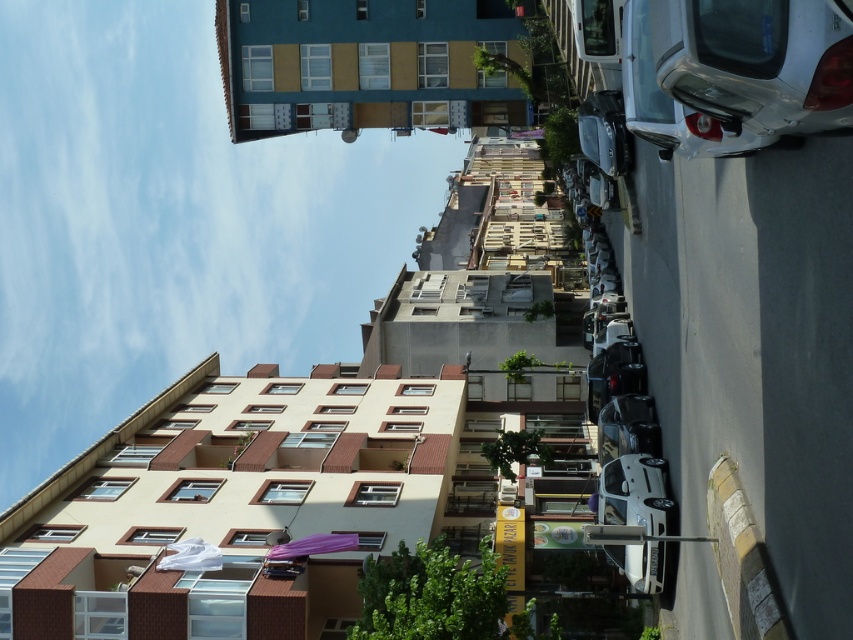
Question: Among these objects, which one is nearest to the camera?

Choices:
 (A) shiny silver car at center
 (B) shiny black car at center

Answer: (A)

Question: Among these objects, which one is farthest from the camera?

Choices:
 (A) white glossy car at right
 (B) shiny black car at center

Answer: (B)

Question: In this image, where is white glossy car at right located relative to white glossy car at center?

Choices:
 (A) right
 (B) left

Answer: (B)

Question: Does shiny silver car at center have a greater width compared to shiny black car at center?

Choices:
 (A) yes
 (B) no

Answer: (B)

Question: Which of the following is the closest to the observer?

Choices:
 (A) pos(599,358)
 (B) pos(682,147)

Answer: (B)

Question: Is white glossy car at right wider than white glossy car at center?

Choices:
 (A) yes
 (B) no

Answer: (A)